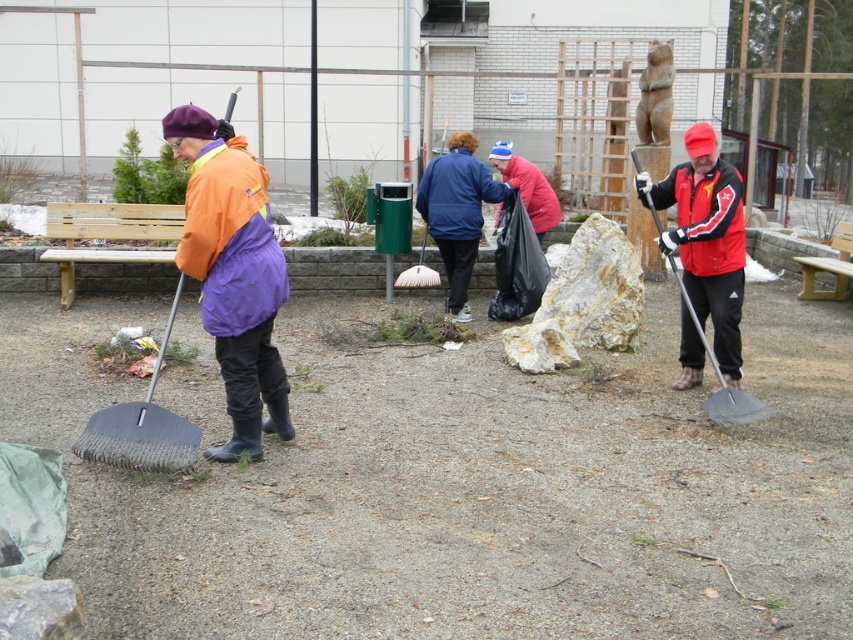
Question: Which point is farther to the camera?

Choices:
 (A) (193, 116)
 (B) (521, 157)
 (C) (465, 152)
 (D) (737, 244)

Answer: (B)

Question: Can you confirm if blue fabric jacket at center is positioned to the left of red matte jacket at right?

Choices:
 (A) no
 (B) yes

Answer: (B)

Question: Among these objects, which one is farthest from the camera?

Choices:
 (A) dark gray rubber shovel at left
 (B) red matte jacket at center
 (C) matte black shovel at right

Answer: (B)

Question: Is blue fabric jacket at center thinner than red matte jacket at center?

Choices:
 (A) no
 (B) yes

Answer: (A)

Question: Estimate the real-world distances between objects in this image. Which object is closer to the red matte jacket at right?

Choices:
 (A) blue fabric jacket at center
 (B) matte black shovel at right
 (C) red matte jacket at center
 (D) dark gray rubber shovel at left

Answer: (B)

Question: Where is blue fabric jacket at center located in relation to red matte jacket at center in the image?

Choices:
 (A) below
 (B) above

Answer: (A)